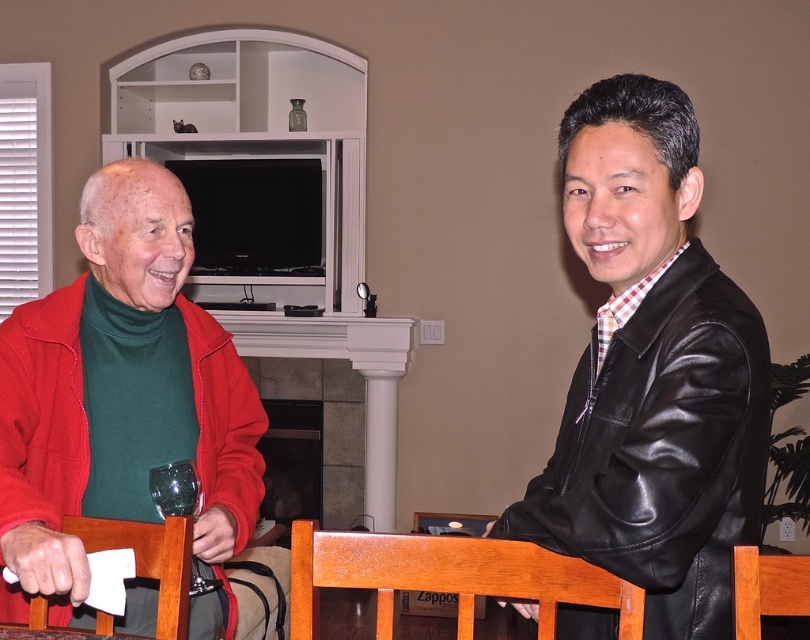
Question: Which object is farther from the camera taking this photo?

Choices:
 (A) matte red jacket at left
 (B) black leather jacket at right

Answer: (A)

Question: Observing the image, what is the correct spatial positioning of matte red jacket at left in reference to black leather jacket at right?

Choices:
 (A) below
 (B) above

Answer: (B)

Question: Is matte red jacket at left thinner than black leather jacket at right?

Choices:
 (A) yes
 (B) no

Answer: (B)

Question: Which point is closer to the camera?

Choices:
 (A) (199, 566)
 (B) (646, 616)

Answer: (B)

Question: Which is nearer to the matte red jacket at left?

Choices:
 (A) black leather jacket at right
 (B) shiny green glass at lower left

Answer: (B)

Question: Can you confirm if black leather jacket at right is wider than shiny green glass at lower left?

Choices:
 (A) no
 (B) yes

Answer: (B)